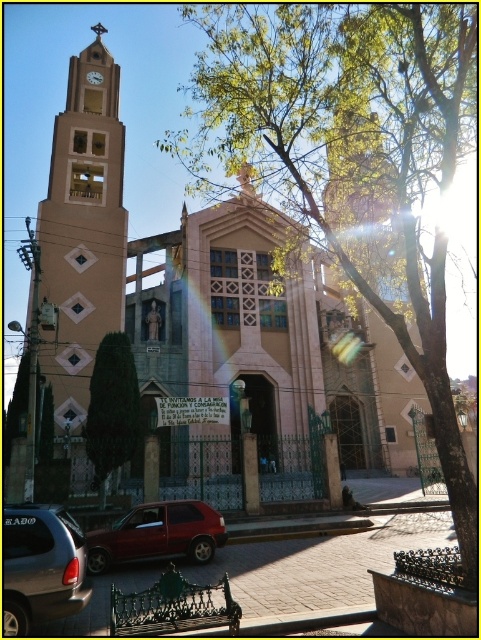
Can you confirm if green leafy tree at upper center is positioned to the right of light beige stone bell tower at left?

Indeed, green leafy tree at upper center is positioned on the right side of light beige stone bell tower at left.

Between point (270, 60) and point (84, 346), which one is positioned behind?

The point (84, 346) is more distant.

Which is behind, point (425, 51) or point (48, 218)?

The point (48, 218) is more distant.

Locate an element on the screen. green leafy tree at upper center is located at coordinates (350, 156).

Is light beige stone bell tower at left taller than silver metallic suv at lower left?

Correct, light beige stone bell tower at left is much taller as silver metallic suv at lower left.

Is light beige stone bell tower at left above silver metallic suv at lower left?

Yes, light beige stone bell tower at left is above silver metallic suv at lower left.

Measure the distance between point (68,307) and camera.

Point (68,307) and camera are 70.63 meters apart.

Where is `light beige stone bell tower at left`? The image size is (481, 640). light beige stone bell tower at left is located at coordinates (x=83, y=234).

Which is in front, point (60, 612) or point (194, 512)?

Point (60, 612) is more forward.

Who is shorter, silver metallic suv at lower left or metallic red car at lower left?

metallic red car at lower left

I want to click on silver metallic suv at lower left, so click(41, 566).